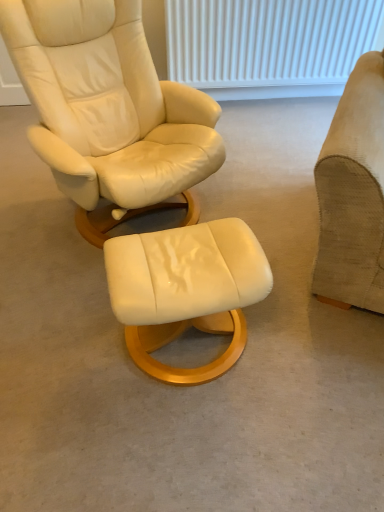
Identify the location of vacant space underneath matte cream leather stool at center (from a real-world perspective). Image resolution: width=384 pixels, height=512 pixels. (193, 348).